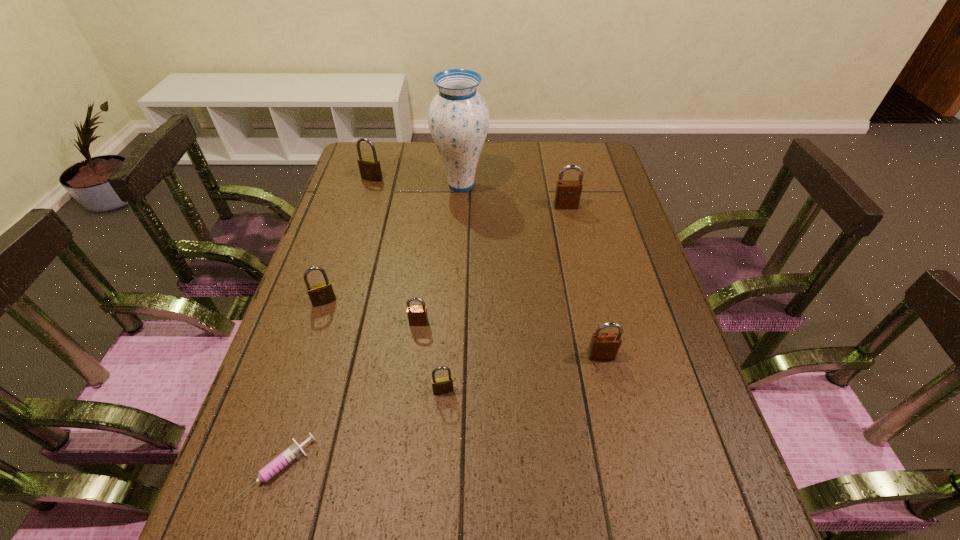
In order to click on vacant region located 0.320m on the front-facing side of the sixth farthest object in this screenshot , I will do `click(637, 516)`.

The width and height of the screenshot is (960, 540). What are the coordinates of `free space located on the right of the nearest padlock` in the screenshot? It's located at (482, 390).

At what (x,y) coordinates should I click in order to perform the action: click on free space located on the front-facing side of the fourth nearest object. Please return your answer as a coordinate pair (x, y). This screenshot has width=960, height=540. Looking at the image, I should click on (413, 369).

Find the location of `free space located 0.280m on the back of the white syringe`. free space located 0.280m on the back of the white syringe is located at coordinates (322, 324).

This screenshot has height=540, width=960. I want to click on vase located in the far edge section of the desktop, so click(x=458, y=117).

Locate an element on the screen. Image resolution: width=960 pixels, height=540 pixels. padlock located in the far edge section of the desktop is located at coordinates (370, 169).

The height and width of the screenshot is (540, 960). Find the location of `syringe that is at the left edge`. syringe that is at the left edge is located at coordinates (292, 452).

Identify the location of object present at the far left corner. click(370, 169).

In the image, there is a desktop. Identify the location of free space at the far edge. (400, 160).

Locate an element on the screen. vacant area at the near edge of the desktop is located at coordinates (339, 533).